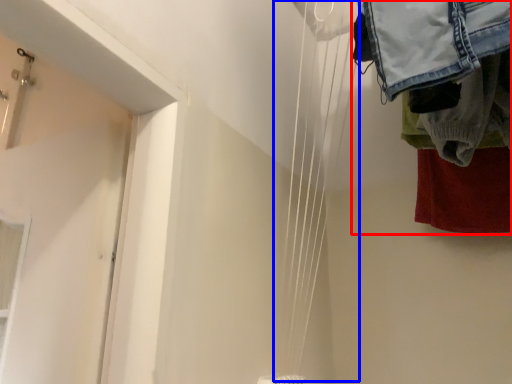
Question: Among these objects, which one is nearest to the camera, laundry (highlighted by a red box) or wire (highlighted by a blue box)?

Choices:
 (A) laundry
 (B) wire

Answer: (B)